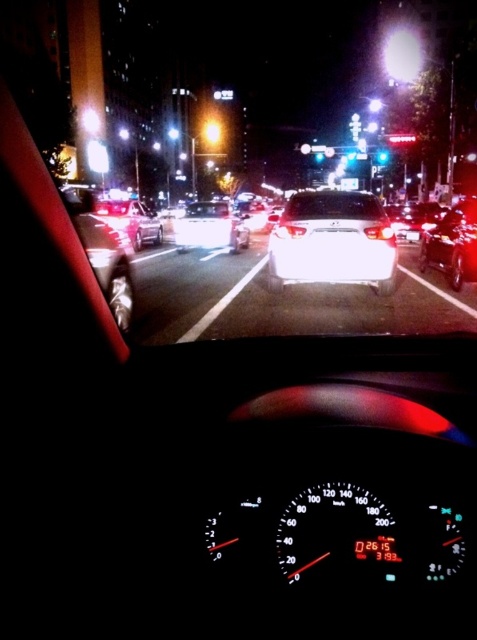
Question: Which of these objects is positioned closest to the bright yellow streetlight at upper center?

Choices:
 (A) shiny black sedan at right
 (B) shiny silver sedan at center

Answer: (B)

Question: Does clear glass windshield at center appear on the left side of green glass traffic light at center?

Choices:
 (A) yes
 (B) no

Answer: (A)

Question: Among these points, which one is nearest to the camera?

Choices:
 (A) (358, 192)
 (B) (218, 225)
 (C) (162, 240)

Answer: (A)

Question: Which point appears closest to the camera in this image?

Choices:
 (A) (311, 195)
 (B) (353, 268)
 (C) (219, 129)
 (D) (132, 220)

Answer: (B)

Question: Is white glossy sedan at center further to camera compared to bright white light at upper center?

Choices:
 (A) no
 (B) yes

Answer: (A)

Question: Does shiny silver sedan at center have a smaller size compared to green glass traffic light at center?

Choices:
 (A) yes
 (B) no

Answer: (A)